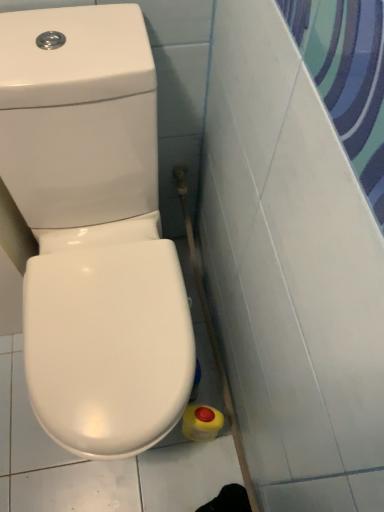
Question: Is there a large distance between white glossy toilet at lower left and yellow matte bottle at lower right?

Choices:
 (A) no
 (B) yes

Answer: (A)

Question: Is white glossy toilet at lower left completely or partially outside of yellow matte bottle at lower right?

Choices:
 (A) yes
 (B) no

Answer: (A)

Question: From a real-world perspective, is white glossy toilet at lower left positioned over yellow matte bottle at lower right based on gravity?

Choices:
 (A) no
 (B) yes

Answer: (B)

Question: Can yellow matte bottle at lower right be found inside white glossy toilet at lower left?

Choices:
 (A) no
 (B) yes

Answer: (B)

Question: Considering the relative positions of white glossy toilet at lower left and yellow matte bottle at lower right in the image provided, is white glossy toilet at lower left to the left of yellow matte bottle at lower right from the viewer's perspective?

Choices:
 (A) yes
 (B) no

Answer: (A)

Question: Is white glossy toilet at lower left touching yellow matte bottle at lower right?

Choices:
 (A) yes
 (B) no

Answer: (B)

Question: From the image's perspective, is yellow matte bottle at lower right located above white glossy toilet at lower left?

Choices:
 (A) yes
 (B) no

Answer: (B)

Question: Can you confirm if yellow matte bottle at lower right is bigger than white glossy toilet at lower left?

Choices:
 (A) yes
 (B) no

Answer: (B)

Question: Is yellow matte bottle at lower right at the right side of white glossy toilet at lower left?

Choices:
 (A) yes
 (B) no

Answer: (A)

Question: Does yellow matte bottle at lower right have a greater height compared to white glossy toilet at lower left?

Choices:
 (A) yes
 (B) no

Answer: (B)

Question: From a real-world perspective, is yellow matte bottle at lower right below white glossy toilet at lower left?

Choices:
 (A) yes
 (B) no

Answer: (A)

Question: Considering the relative sizes of yellow matte bottle at lower right and white glossy toilet at lower left in the image provided, is yellow matte bottle at lower right thinner than white glossy toilet at lower left?

Choices:
 (A) yes
 (B) no

Answer: (A)

Question: Is yellow matte bottle at lower right spatially inside white glossy toilet at lower left, or outside of it?

Choices:
 (A) inside
 (B) outside

Answer: (A)